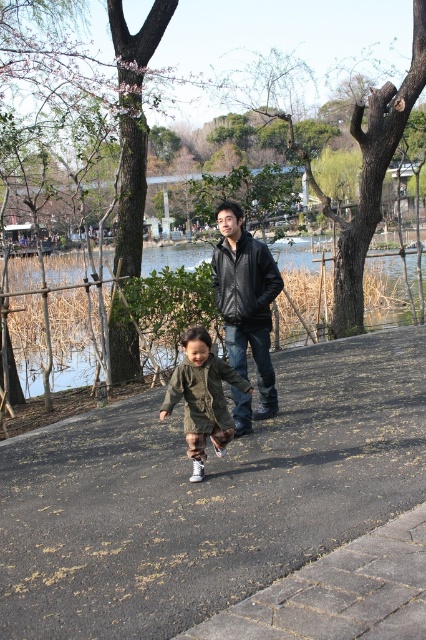
Question: Estimate the real-world distances between objects in this image. Which object is farther from the olive-green fabric jacket at center?

Choices:
 (A) black leather jacket at center
 (B) leather jacket at center

Answer: (B)

Question: Considering the real-world distances, which object is closest to the leather jacket at center?

Choices:
 (A) dark asphalt pavement at center
 (B) asphalt at lower center
 (C) olive-green fabric jacket at center

Answer: (C)

Question: Does dark asphalt pavement at center have a greater width compared to asphalt at lower center?

Choices:
 (A) yes
 (B) no

Answer: (B)

Question: Among these objects, which one is farthest from the camera?

Choices:
 (A) black leather jacket at center
 (B) olive-green fabric jacket at center

Answer: (A)

Question: Does olive-green fabric jacket at center have a greater width compared to leather jacket at center?

Choices:
 (A) yes
 (B) no

Answer: (A)

Question: Does black leather jacket at center appear on the left side of leather jacket at center?

Choices:
 (A) yes
 (B) no

Answer: (B)